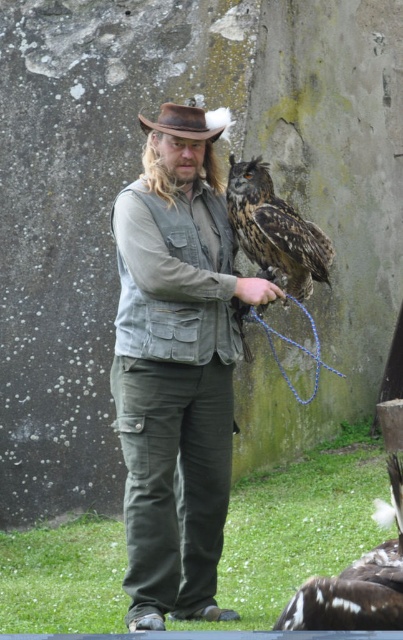
This screenshot has height=640, width=403. Describe the element at coordinates (355, 584) in the screenshot. I see `dark brown feathers at lower right` at that location.

Between point (400, 468) and point (228, 285), which one is positioned in front?

Positioned in front is point (400, 468).

The height and width of the screenshot is (640, 403). What are the coordinates of `dark brown feathers at lower right` in the screenshot? It's located at 355,584.

Who is positioned more to the left, leather vest at center or brown leather cowboy hat at center?

leather vest at center

Is point (216, 486) positioned behind point (151, 122)?

No.

Is point (118, 216) closer to viewer compared to point (207, 113)?

That is True.

Where is `leather vest at center`? The height and width of the screenshot is (640, 403). leather vest at center is located at coordinates (174, 378).

Which is behind, point (155, 496) or point (149, 256)?

The point (155, 496) is more distant.

Between leather vest at center and denim vest at center, which one has more height?

leather vest at center is taller.

Does point (166, 470) come closer to viewer compared to point (141, 269)?

No, (166, 470) is further to viewer.

The height and width of the screenshot is (640, 403). What are the coordinates of `leather vest at center` in the screenshot? It's located at (174, 378).